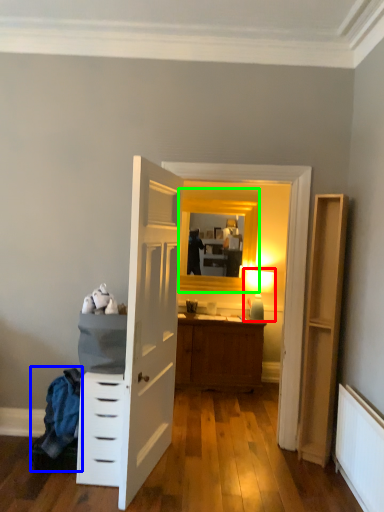
Question: Estimate the real-world distances between objects in this image. Which object is farther from light fixture (highlighted by a red box), laundry (highlighted by a blue box) or window (highlighted by a green box)?

Choices:
 (A) laundry
 (B) window

Answer: (A)